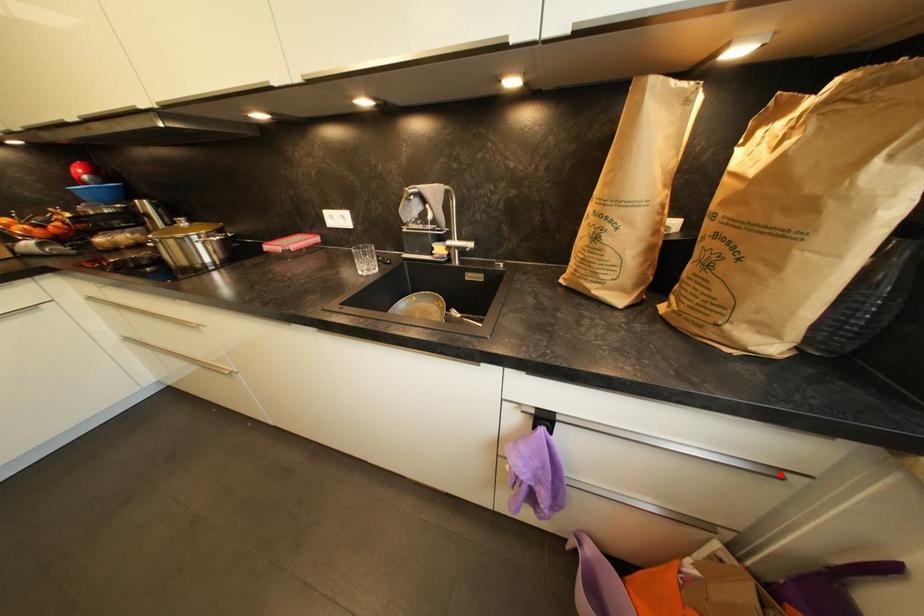
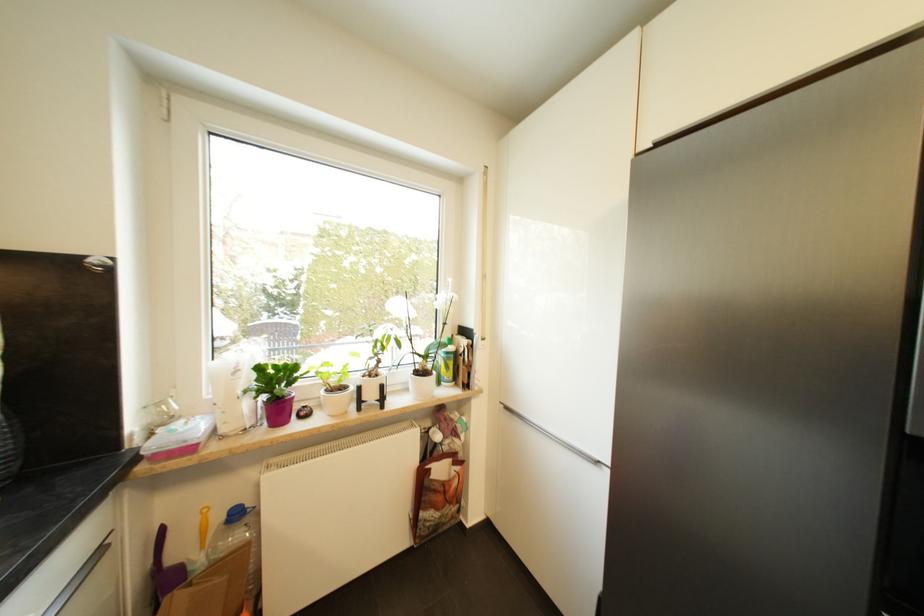
Question: I am providing you with two images of the same scene from different viewpoints. In image1, a red point is highlighted. Considering the same 3D point in image2, which of the following is correct?

Choices:
 (A) It is closer
 (B) It is farther

Answer: (B)